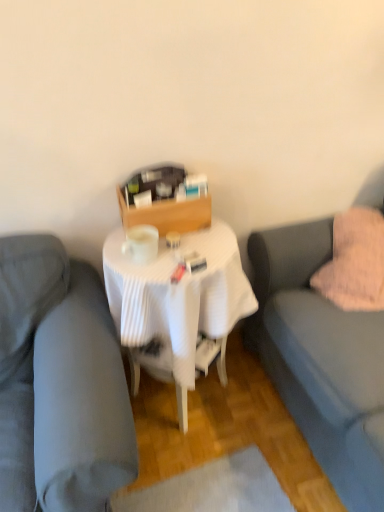
Question: Would you say pink fluffy pillow at right is a long distance from matte gray couch at center, which appears as the second studio couch when viewed from the right?

Choices:
 (A) yes
 (B) no

Answer: (B)

Question: Is pink fluffy pillow at right bigger than matte gray couch at center, which appears as the second studio couch when viewed from the right?

Choices:
 (A) yes
 (B) no

Answer: (B)

Question: Can you confirm if pink fluffy pillow at right is positioned to the left of matte gray couch at center, the first studio couch positioned from the left?

Choices:
 (A) yes
 (B) no

Answer: (B)

Question: Considering the relative sizes of pink fluffy pillow at right and matte gray couch at center, which appears as the second studio couch when viewed from the right, in the image provided, is pink fluffy pillow at right wider than matte gray couch at center, which appears as the second studio couch when viewed from the right,?

Choices:
 (A) no
 (B) yes

Answer: (A)

Question: From the image's perspective, does pink fluffy pillow at right appear lower than matte gray couch at center, which appears as the second studio couch when viewed from the right?

Choices:
 (A) no
 (B) yes

Answer: (A)

Question: Is point (203, 265) closer or farther from the camera than point (369, 323)?

Choices:
 (A) farther
 (B) closer

Answer: (B)

Question: From a real-world perspective, is white pleated tablecloth at center positioned above or below soft gray fabric couch at right, the second studio couch in the left-to-right sequence?

Choices:
 (A) below
 (B) above

Answer: (A)

Question: In terms of height, does white pleated tablecloth at center look taller or shorter compared to soft gray fabric couch at right, arranged as the 1th studio couch when viewed from the right?

Choices:
 (A) short
 (B) tall

Answer: (A)

Question: Based on their positions, is white pleated tablecloth at center located to the left or right of soft gray fabric couch at right, the second studio couch in the left-to-right sequence?

Choices:
 (A) left
 (B) right

Answer: (A)

Question: Looking at the image, does matte gray couch at center, the first studio couch positioned from the left, seem bigger or smaller compared to white pleated tablecloth at center?

Choices:
 (A) small
 (B) big

Answer: (B)

Question: From a real-world perspective, is matte gray couch at center, the first studio couch positioned from the left, physically located above or below white pleated tablecloth at center?

Choices:
 (A) below
 (B) above

Answer: (B)

Question: Considering the positions of matte gray couch at center, the first studio couch positioned from the left, and white pleated tablecloth at center in the image, is matte gray couch at center, the first studio couch positioned from the left, wider or thinner than white pleated tablecloth at center?

Choices:
 (A) thin
 (B) wide

Answer: (B)

Question: Is matte gray couch at center, the first studio couch positioned from the left, to the left or to the right of white pleated tablecloth at center in the image?

Choices:
 (A) right
 (B) left

Answer: (B)

Question: From a real-world perspective, is white pleated tablecloth at center physically located above or below matte gray couch at center, the first studio couch positioned from the left?

Choices:
 (A) above
 (B) below

Answer: (B)

Question: From the image's perspective, relative to matte gray couch at center, the first studio couch positioned from the left, is white pleated tablecloth at center above or below?

Choices:
 (A) above
 (B) below

Answer: (A)